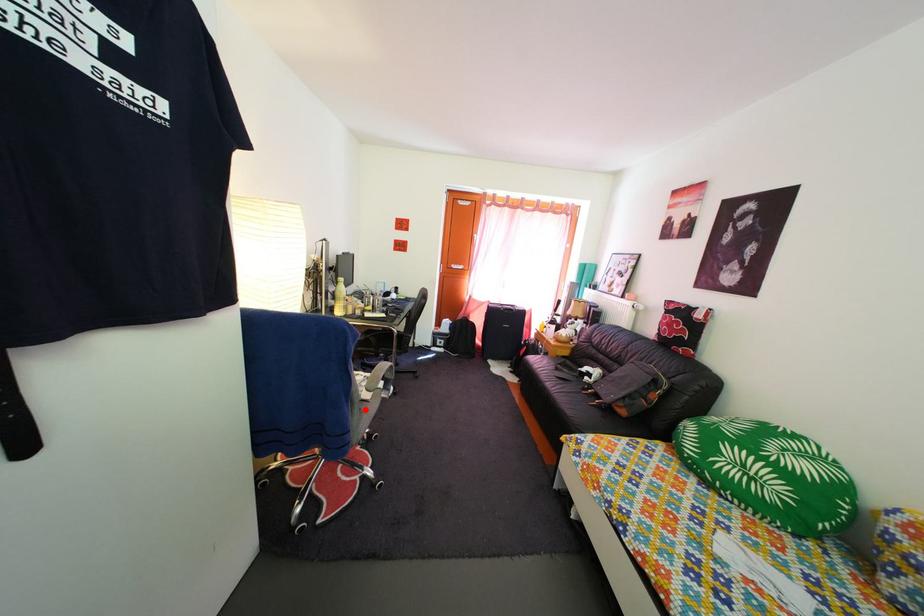
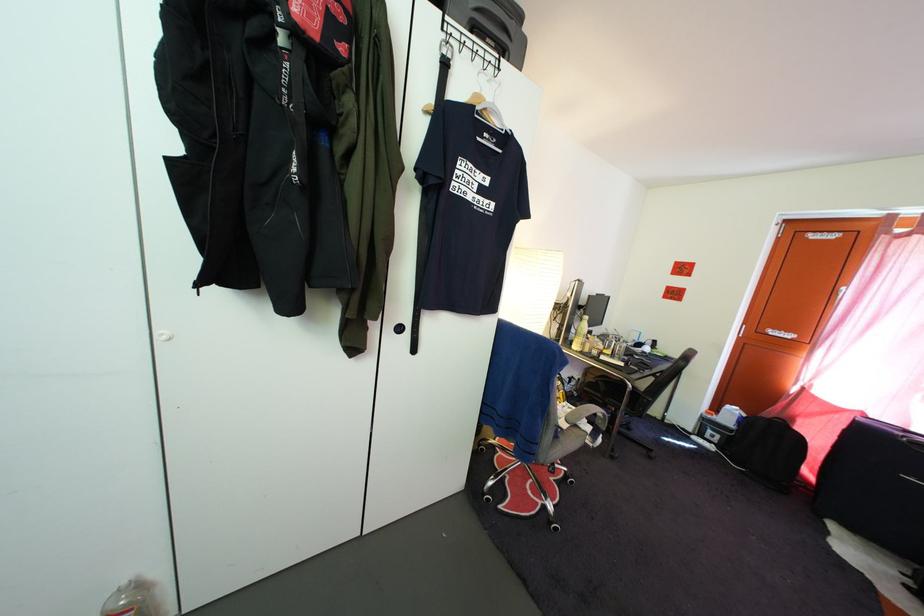
In the second image, find the point that corresponds to the highlighted location in the first image.

(562, 432)